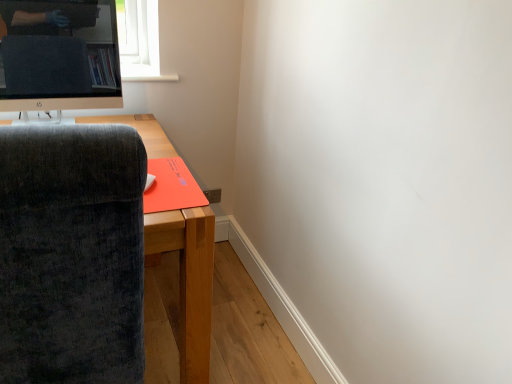
Question: Considering the relative positions of dark gray fabric chair at left and velvet dark gray chair at left in the image provided, is dark gray fabric chair at left to the left of velvet dark gray chair at left from the viewer's perspective?

Choices:
 (A) yes
 (B) no

Answer: (A)

Question: Is dark gray fabric chair at left taller than velvet dark gray chair at left?

Choices:
 (A) yes
 (B) no

Answer: (B)

Question: Is dark gray fabric chair at left outside velvet dark gray chair at left?

Choices:
 (A) no
 (B) yes

Answer: (B)

Question: Does dark gray fabric chair at left come in front of velvet dark gray chair at left?

Choices:
 (A) no
 (B) yes

Answer: (A)

Question: Is velvet dark gray chair at left inside dark gray fabric chair at left?

Choices:
 (A) no
 (B) yes

Answer: (A)

Question: From a real-world perspective, is dark gray fabric chair at left over velvet dark gray chair at left?

Choices:
 (A) no
 (B) yes

Answer: (A)

Question: Does orange matte mousepad at lower left have a lesser height compared to velvet dark gray chair at left?

Choices:
 (A) no
 (B) yes

Answer: (B)

Question: Is velvet dark gray chair at left at the back of orange matte mousepad at lower left?

Choices:
 (A) no
 (B) yes

Answer: (A)

Question: Is orange matte mousepad at lower left in front of velvet dark gray chair at left?

Choices:
 (A) yes
 (B) no

Answer: (B)

Question: Are orange matte mousepad at lower left and velvet dark gray chair at left located far from each other?

Choices:
 (A) yes
 (B) no

Answer: (B)

Question: Could velvet dark gray chair at left be considered to be inside orange matte mousepad at lower left?

Choices:
 (A) no
 (B) yes

Answer: (A)

Question: From a real-world perspective, is orange matte mousepad at lower left physically above velvet dark gray chair at left?

Choices:
 (A) no
 (B) yes

Answer: (B)

Question: Considering the relative sizes of velvet dark gray chair at left and satin black monitor at upper left in the image provided, is velvet dark gray chair at left shorter than satin black monitor at upper left?

Choices:
 (A) no
 (B) yes

Answer: (A)